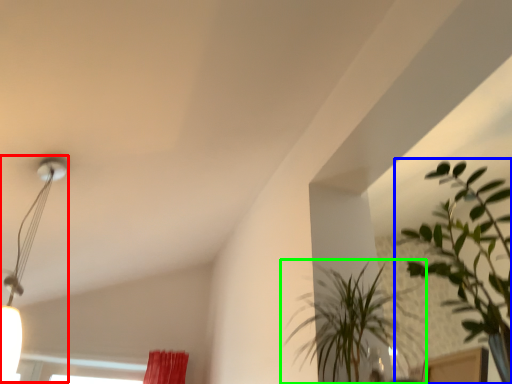
Question: Which object is the closest to the lamp (highlighted by a red box)? Choose among these: houseplant (highlighted by a blue box) or houseplant (highlighted by a green box).

Choices:
 (A) houseplant
 (B) houseplant

Answer: (B)